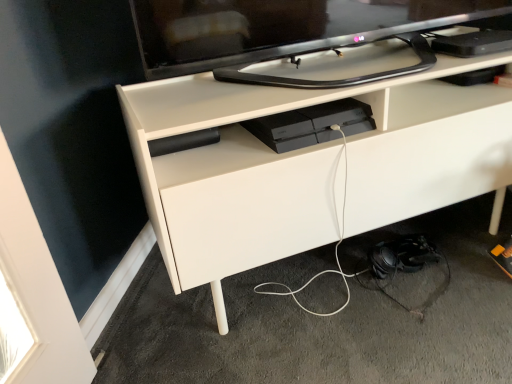
Question: Can you confirm if satin black console at center is positioned to the right of white matte desk at center?

Choices:
 (A) no
 (B) yes

Answer: (A)

Question: Does satin black console at center have a greater width compared to white matte desk at center?

Choices:
 (A) no
 (B) yes

Answer: (A)

Question: Is satin black console at center oriented towards white matte desk at center?

Choices:
 (A) no
 (B) yes

Answer: (B)

Question: Are satin black console at center and white matte desk at center far apart?

Choices:
 (A) no
 (B) yes

Answer: (A)

Question: Is satin black console at center positioned beyond the bounds of white matte desk at center?

Choices:
 (A) no
 (B) yes

Answer: (A)

Question: From a real-world perspective, relative to white matte desk at center, is black glossy tv at upper center vertically above or below?

Choices:
 (A) below
 (B) above

Answer: (B)

Question: Is black glossy tv at upper center situated inside white matte desk at center or outside?

Choices:
 (A) outside
 (B) inside

Answer: (A)

Question: Considering the positions of black glossy tv at upper center and white matte desk at center in the image, is black glossy tv at upper center bigger or smaller than white matte desk at center?

Choices:
 (A) small
 (B) big

Answer: (A)

Question: Is black glossy tv at upper center wider or thinner than white matte desk at center?

Choices:
 (A) wide
 (B) thin

Answer: (B)

Question: Considering the positions of white matte cable at lower center and white matte desk at center in the image, is white matte cable at lower center wider or thinner than white matte desk at center?

Choices:
 (A) wide
 (B) thin

Answer: (A)

Question: Would you say white matte cable at lower center is to the left or to the right of white matte desk at center in the picture?

Choices:
 (A) right
 (B) left

Answer: (A)

Question: From a real-world perspective, is white matte cable at lower center physically located above or below white matte desk at center?

Choices:
 (A) below
 (B) above

Answer: (A)

Question: From the image's perspective, is white matte cable at lower center above or below white matte desk at center?

Choices:
 (A) above
 (B) below

Answer: (B)

Question: Is point (480, 354) closer or farther from the camera than point (390, 29)?

Choices:
 (A) farther
 (B) closer

Answer: (B)

Question: Would you say white matte cable at lower center is to the left or to the right of black glossy tv at upper center in the picture?

Choices:
 (A) left
 (B) right

Answer: (B)